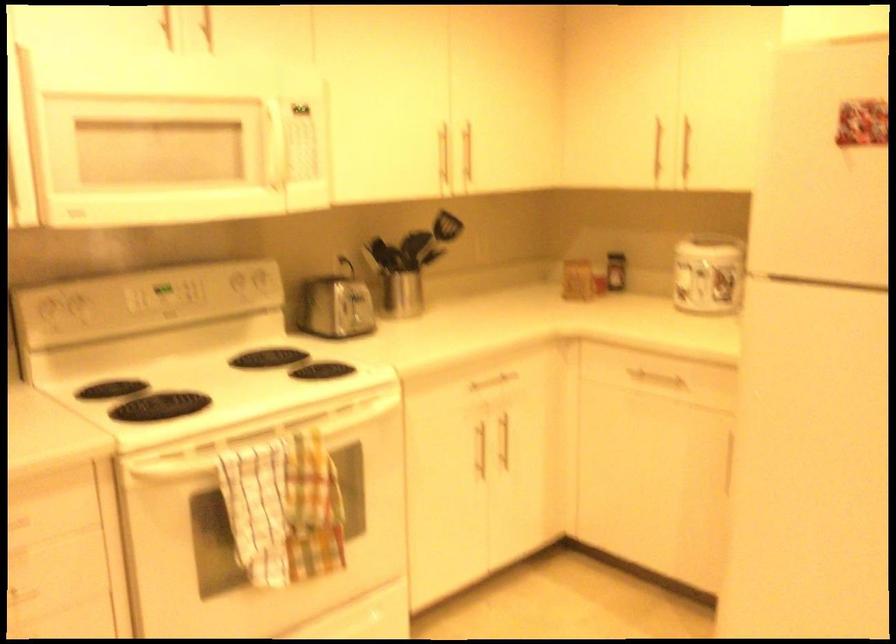
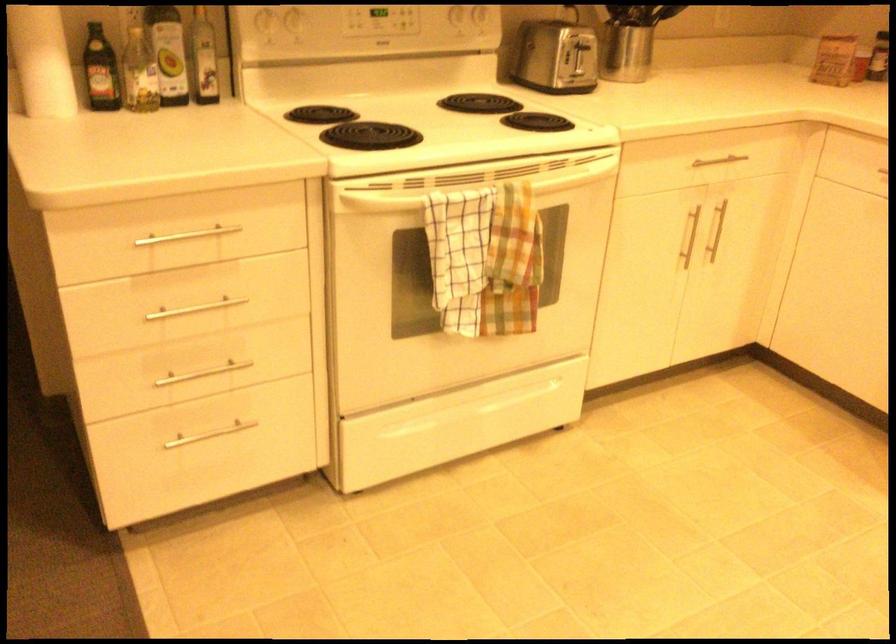
In the second image, find the point that corresponds to the point at 352,317 in the first image.

(572, 73)